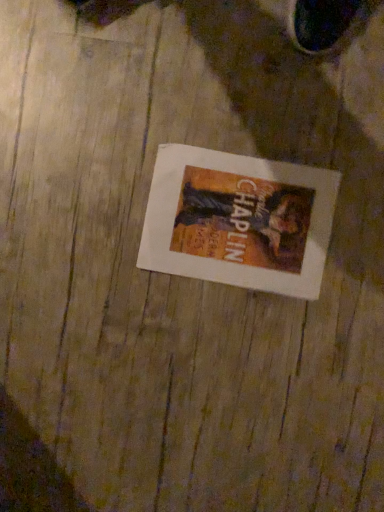
Where is `white paper book at center`? white paper book at center is located at coordinates (238, 220).

In order to face white paper book at center, should I rotate leftwards or rightwards?

Turn right by 5.879 degrees to look at white paper book at center.

Describe the element at coordinates (238, 220) in the screenshot. I see `white paper book at center` at that location.

Locate an element on the screen. The width and height of the screenshot is (384, 512). white paper book at center is located at coordinates (238, 220).